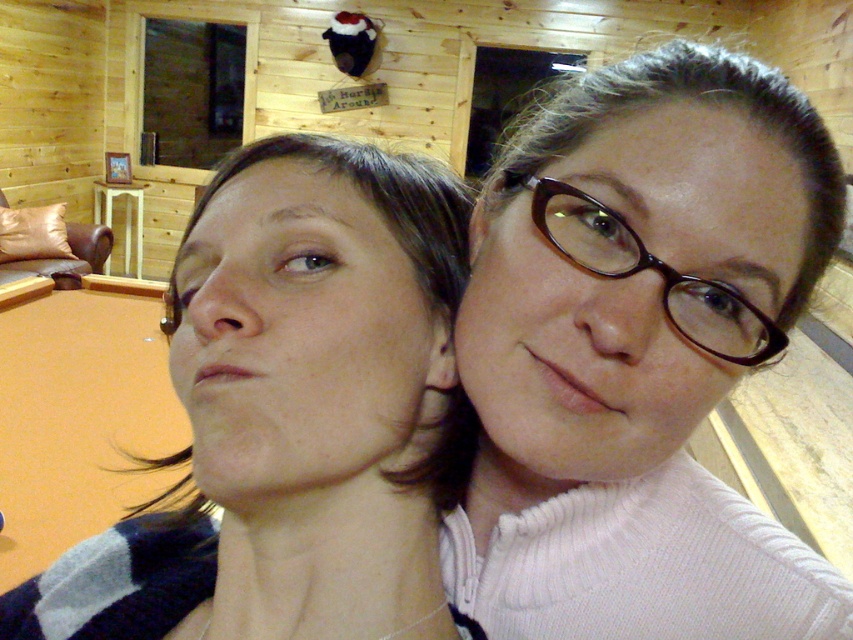
You are trying to decide where to place a new plant stand that requires 1.2 meters of height. You see the white knit sweater at center and the orange felt billiard table at lower left. Which object has enough vertical space to place the plant stand?

The orange felt billiard table at lower left is taller than the white knit sweater at center, so it has enough vertical space to place the plant stand.

From the picture: You are trying to take a photo of the brown glossy glasses at center but want to avoid the orange felt billiard table at lower left from blocking the view. Can you move the glasses forward so they are in front of the table?

The brown glossy glasses at center is currently behind the orange felt billiard table at lower left, so moving them forward would place them in front of the table, avoiding obstruction.

You are a photographer setting up a shoot in this cozy indoor cabin. You need to position a light source to highlight both the matte blue sweater at left and the brown glossy glasses at center. Since the glasses are reflective, you want to avoid glare. Based on their positions, where should you place the light source relative to the photographer?

The matte blue sweater at left is located below the brown glossy glasses at center. To avoid glare on the brown glossy glasses at center, the light source should be placed above and behind the photographer, so that the light hits the glasses from above and reflects away from the camera lens.